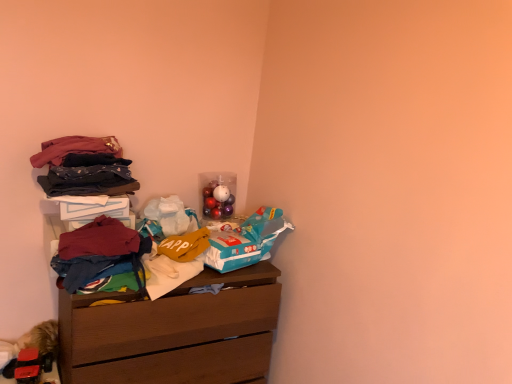
The height and width of the screenshot is (384, 512). In order to click on maroon fabric shirt at left, which is the 3th clothing in top-to-bottom order in this screenshot , I will do `click(99, 239)`.

The height and width of the screenshot is (384, 512). What do you see at coordinates (99, 239) in the screenshot? I see `maroon fabric shirt at left, which is the 3th clothing in top-to-bottom order` at bounding box center [99, 239].

I want to click on dark blue cotton pants at left, marked as the third clothing in a bottom-to-top arrangement, so click(x=88, y=180).

Where is `velvet-like fabric at upper left, the first clothing in the top-to-bottom sequence`? The height and width of the screenshot is (384, 512). velvet-like fabric at upper left, the first clothing in the top-to-bottom sequence is located at coordinates (84, 167).

At what (x,y) coordinates should I click in order to perform the action: click on wooden chest of drawers at upper left. Please return your answer as a coordinate pair (x, y). Looking at the image, I should click on (173, 332).

Is dark blue cotton pants at left, marked as the third clothing in a bottom-to-top arrangement, positioned far away from maroon fabric shirt at left, which is counted as the second clothing, starting from the bottom?

That's not correct — dark blue cotton pants at left, marked as the third clothing in a bottom-to-top arrangement, is a little close to maroon fabric shirt at left, which is counted as the second clothing, starting from the bottom.

Measure the distance between dark blue cotton pants at left, marked as the 2th clothing in a top-to-bottom arrangement, and maroon fabric shirt at left, which is the 3th clothing in top-to-bottom order.

6.36 inches.

Consider the image. Is dark blue cotton pants at left, marked as the third clothing in a bottom-to-top arrangement, facing away from maroon fabric shirt at left, which is the 3th clothing in top-to-bottom order?

No, dark blue cotton pants at left, marked as the third clothing in a bottom-to-top arrangement, is not facing away from maroon fabric shirt at left, which is the 3th clothing in top-to-bottom order.

Consider the image. Considering the sizes of objects dark blue cotton pants at left, marked as the 2th clothing in a top-to-bottom arrangement, and maroon fabric shirt at left, which is counted as the second clothing, starting from the bottom, in the image provided, who is thinner, dark blue cotton pants at left, marked as the 2th clothing in a top-to-bottom arrangement, or maroon fabric shirt at left, which is counted as the second clothing, starting from the bottom,?

maroon fabric shirt at left, which is counted as the second clothing, starting from the bottom.

Is multicolored fabric at center, which appears as the 4th clothing when viewed from the top, spatially inside velvet-like fabric at upper left, the first clothing in the top-to-bottom sequence, or outside of it?

multicolored fabric at center, which appears as the 4th clothing when viewed from the top, is spatially situated outside velvet-like fabric at upper left, the first clothing in the top-to-bottom sequence.

Can you confirm if multicolored fabric at center, which appears as the 4th clothing when viewed from the top, is thinner than velvet-like fabric at upper left, the first clothing in the top-to-bottom sequence?

Indeed, multicolored fabric at center, which appears as the 4th clothing when viewed from the top, has a lesser width compared to velvet-like fabric at upper left, the first clothing in the top-to-bottom sequence.

Can you tell me how much multicolored fabric at center, which is the 1th clothing in bottom-to-top order, and velvet-like fabric at upper left, the first clothing in the top-to-bottom sequence, differ in facing direction?

The facing directions of multicolored fabric at center, which is the 1th clothing in bottom-to-top order, and velvet-like fabric at upper left, the first clothing in the top-to-bottom sequence, are 0.0756 degrees apart.

Is multicolored fabric at center, which appears as the 4th clothing when viewed from the top, positioned far away from velvet-like fabric at upper left, the fourth clothing ordered from the bottom?

multicolored fabric at center, which appears as the 4th clothing when viewed from the top, is near velvet-like fabric at upper left, the fourth clothing ordered from the bottom, not far away.

Is dark blue cotton pants at left, marked as the third clothing in a bottom-to-top arrangement, at the back of velvet-like fabric at upper left, the first clothing in the top-to-bottom sequence?

No.

Identify the location of clothing on the left of dark blue cotton pants at left, marked as the third clothing in a bottom-to-top arrangement. This screenshot has height=384, width=512. (84, 167).

Which is correct: velvet-like fabric at upper left, the fourth clothing ordered from the bottom, is inside dark blue cotton pants at left, marked as the 2th clothing in a top-to-bottom arrangement, or outside of it?

velvet-like fabric at upper left, the fourth clothing ordered from the bottom, is not enclosed by dark blue cotton pants at left, marked as the 2th clothing in a top-to-bottom arrangement.

Is velvet-like fabric at upper left, the first clothing in the top-to-bottom sequence, in front of or behind dark blue cotton pants at left, marked as the third clothing in a bottom-to-top arrangement, in the image?

In the image, velvet-like fabric at upper left, the first clothing in the top-to-bottom sequence, appears behind dark blue cotton pants at left, marked as the third clothing in a bottom-to-top arrangement.

Is maroon fabric shirt at left, which is the 3th clothing in top-to-bottom order, placed right next to velvet-like fabric at upper left, the fourth clothing ordered from the bottom?

No, maroon fabric shirt at left, which is the 3th clothing in top-to-bottom order, is not in contact with velvet-like fabric at upper left, the fourth clothing ordered from the bottom.

Could you tell me if maroon fabric shirt at left, which is the 3th clothing in top-to-bottom order, is turned towards velvet-like fabric at upper left, the first clothing in the top-to-bottom sequence?

No, maroon fabric shirt at left, which is the 3th clothing in top-to-bottom order, is not turned towards velvet-like fabric at upper left, the first clothing in the top-to-bottom sequence.

Does point (126, 231) come in front of point (97, 151)?

Yes, it is.

Is maroon fabric shirt at left, which is the 3th clothing in top-to-bottom order, spatially inside velvet-like fabric at upper left, the fourth clothing ordered from the bottom, or outside of it?

maroon fabric shirt at left, which is the 3th clothing in top-to-bottom order, is not enclosed by velvet-like fabric at upper left, the fourth clothing ordered from the bottom.

Based on their sizes in the image, would you say multicolored fabric at center, which is the 1th clothing in bottom-to-top order, is bigger or smaller than dark blue cotton pants at left, marked as the third clothing in a bottom-to-top arrangement?

Considering their sizes, multicolored fabric at center, which is the 1th clothing in bottom-to-top order, takes up more space than dark blue cotton pants at left, marked as the third clothing in a bottom-to-top arrangement.

Which is more to the left, multicolored fabric at center, which appears as the 4th clothing when viewed from the top, or dark blue cotton pants at left, marked as the third clothing in a bottom-to-top arrangement?

Positioned to the left is dark blue cotton pants at left, marked as the third clothing in a bottom-to-top arrangement.

Is multicolored fabric at center, which is the 1th clothing in bottom-to-top order, located outside dark blue cotton pants at left, marked as the 2th clothing in a top-to-bottom arrangement?

Yes, multicolored fabric at center, which is the 1th clothing in bottom-to-top order, is located beyond the bounds of dark blue cotton pants at left, marked as the 2th clothing in a top-to-bottom arrangement.

How many degrees apart are the facing directions of wooden chest of drawers at upper left and multicolored fabric at center, which is the 1th clothing in bottom-to-top order?

0.827 degrees.

Is wooden chest of drawers at upper left closer to camera compared to multicolored fabric at center, which is the 1th clothing in bottom-to-top order?

No, wooden chest of drawers at upper left is further to the viewer.

Does point (209, 351) come behind point (137, 260)?

Yes, point (209, 351) is behind point (137, 260).

Is the surface of wooden chest of drawers at upper left in direct contact with multicolored fabric at center, which is the 1th clothing in bottom-to-top order?

wooden chest of drawers at upper left and multicolored fabric at center, which is the 1th clothing in bottom-to-top order, are clearly separated.

From a real-world perspective, is velvet-like fabric at upper left, the fourth clothing ordered from the bottom, positioned over multicolored fabric at center, which appears as the 4th clothing when viewed from the top, based on gravity?

Indeed, from a real-world perspective, velvet-like fabric at upper left, the fourth clothing ordered from the bottom, stands above multicolored fabric at center, which appears as the 4th clothing when viewed from the top.

Are velvet-like fabric at upper left, the first clothing in the top-to-bottom sequence, and multicolored fabric at center, which is the 1th clothing in bottom-to-top order, far apart?

Actually, velvet-like fabric at upper left, the first clothing in the top-to-bottom sequence, and multicolored fabric at center, which is the 1th clothing in bottom-to-top order, are a little close together.

Does velvet-like fabric at upper left, the fourth clothing ordered from the bottom, have a lesser width compared to multicolored fabric at center, which is the 1th clothing in bottom-to-top order?

No, velvet-like fabric at upper left, the fourth clothing ordered from the bottom, is not thinner than multicolored fabric at center, which is the 1th clothing in bottom-to-top order.

Which object is more forward, velvet-like fabric at upper left, the first clothing in the top-to-bottom sequence, or multicolored fabric at center, which appears as the 4th clothing when viewed from the top?

Positioned in front is multicolored fabric at center, which appears as the 4th clothing when viewed from the top.

Locate an element on the screen. This screenshot has height=384, width=512. clothing that is the 1st object above the maroon fabric shirt at left, which is the 3th clothing in top-to-bottom order (from a real-world perspective) is located at coordinates (88, 180).

From the multicolored fabric at center, which appears as the 4th clothing when viewed from the top, count the 3rd clothing to the left and point to it. Please provide its 2D coordinates.

[(84, 167)]

Looking at this image, estimate the real-world distances between objects in this image. Which object is further from wooden chest of drawers at upper left, maroon fabric shirt at left, which is the 3th clothing in top-to-bottom order, or velvet-like fabric at upper left, the first clothing in the top-to-bottom sequence?

velvet-like fabric at upper left, the first clothing in the top-to-bottom sequence, lies further to wooden chest of drawers at upper left than the other object.

Which object lies nearer to the anchor point maroon fabric shirt at left, which is the 3th clothing in top-to-bottom order, velvet-like fabric at upper left, the first clothing in the top-to-bottom sequence, or multicolored fabric at center, which appears as the 4th clothing when viewed from the top?

Among the two, multicolored fabric at center, which appears as the 4th clothing when viewed from the top, is located nearer to maroon fabric shirt at left, which is the 3th clothing in top-to-bottom order.

Which object lies further to the anchor point multicolored fabric at center, which is the 1th clothing in bottom-to-top order, wooden chest of drawers at upper left or velvet-like fabric at upper left, the fourth clothing ordered from the bottom?

wooden chest of drawers at upper left lies further to multicolored fabric at center, which is the 1th clothing in bottom-to-top order, than the other object.

When comparing their distances from multicolored fabric at center, which is the 1th clothing in bottom-to-top order, does velvet-like fabric at upper left, the first clothing in the top-to-bottom sequence, or maroon fabric shirt at left, which is counted as the second clothing, starting from the bottom, seem further?

Among the two, velvet-like fabric at upper left, the first clothing in the top-to-bottom sequence, is located further to multicolored fabric at center, which is the 1th clothing in bottom-to-top order.

Looking at this image, looking at the image, which one is located further to multicolored fabric at center, which is the 1th clothing in bottom-to-top order, velvet-like fabric at upper left, the fourth clothing ordered from the bottom, or dark blue cotton pants at left, marked as the third clothing in a bottom-to-top arrangement?

velvet-like fabric at upper left, the fourth clothing ordered from the bottom.

Looking at the image, which one is located further to velvet-like fabric at upper left, the fourth clothing ordered from the bottom, multicolored fabric at center, which is the 1th clothing in bottom-to-top order, or dark blue cotton pants at left, marked as the third clothing in a bottom-to-top arrangement?

multicolored fabric at center, which is the 1th clothing in bottom-to-top order.

Estimate the real-world distances between objects in this image. Which object is closer to wooden chest of drawers at upper left, maroon fabric shirt at left, which is counted as the second clothing, starting from the bottom, or multicolored fabric at center, which appears as the 4th clothing when viewed from the top?

multicolored fabric at center, which appears as the 4th clothing when viewed from the top, is closer to wooden chest of drawers at upper left.

Based on their spatial positions, is dark blue cotton pants at left, marked as the 2th clothing in a top-to-bottom arrangement, or multicolored fabric at center, which is the 1th clothing in bottom-to-top order, closer to wooden chest of drawers at upper left?

multicolored fabric at center, which is the 1th clothing in bottom-to-top order, is positioned closer to the anchor wooden chest of drawers at upper left.

This screenshot has height=384, width=512. Identify the location of clothing that lies between maroon fabric shirt at left, which is the 3th clothing in top-to-bottom order, and wooden chest of drawers at upper left from top to bottom. (97, 251).

The width and height of the screenshot is (512, 384). Identify the location of clothing between velvet-like fabric at upper left, the fourth clothing ordered from the bottom, and maroon fabric shirt at left, which is counted as the second clothing, starting from the bottom, from top to bottom. (88, 180).

Locate an element on the screen. The width and height of the screenshot is (512, 384). clothing between dark blue cotton pants at left, marked as the 2th clothing in a top-to-bottom arrangement, and multicolored fabric at center, which is the 1th clothing in bottom-to-top order, in the vertical direction is located at coordinates (99, 239).